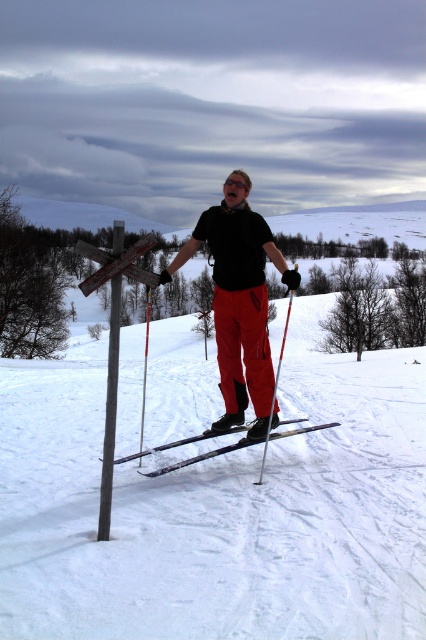
Can you confirm if white powder snow at center is taller than matte red ski pole at center?

Indeed, white powder snow at center has a greater height compared to matte red ski pole at center.

Is point (6, 364) positioned in front of point (282, 342)?

Yes, it is.

Locate an element on the screen. white powder snow at center is located at coordinates (x=218, y=508).

This screenshot has height=640, width=426. What do you see at coordinates (236, 448) in the screenshot?
I see `shiny metallic skis at center` at bounding box center [236, 448].

Is shiny metallic skis at center smaller than matte red ski pole at center?

Correct, shiny metallic skis at center occupies less space than matte red ski pole at center.

Is point (285, 433) behind point (282, 342)?

No, it is in front of (282, 342).

I want to click on shiny metallic skis at center, so click(236, 448).

Does white powder snow at center lie in front of matte black skis at center?

Yes.

Does white powder snow at center appear over matte black skis at center?

Yes.

I want to click on white powder snow at center, so click(218, 508).

At what (x,y) coordinates should I click in order to perform the action: click on white powder snow at center. Please return your answer as a coordinate pair (x, y). Looking at the image, I should click on (218, 508).